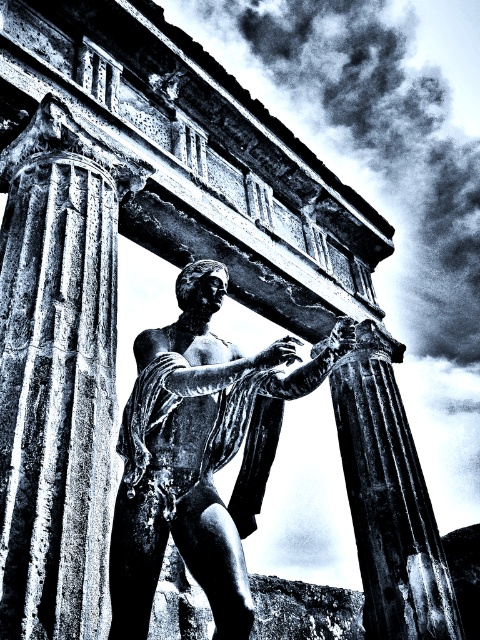
Question: Which of the following is the closest to the observer?

Choices:
 (A) polished bronze statue at center
 (B) smooth stone column at left
 (C) smooth stone column at center

Answer: (B)

Question: Is polished bronze statue at center further to the viewer compared to smooth stone column at center?

Choices:
 (A) yes
 (B) no

Answer: (B)

Question: Which of the following is the farthest from the observer?

Choices:
 (A) smooth stone column at left
 (B) polished bronze statue at center
 (C) smooth stone column at center

Answer: (C)

Question: Is smooth stone column at left above smooth stone column at center?

Choices:
 (A) no
 (B) yes

Answer: (B)

Question: Is polished bronze statue at center wider than smooth stone column at center?

Choices:
 (A) yes
 (B) no

Answer: (A)

Question: Among these objects, which one is farthest from the camera?

Choices:
 (A) polished bronze statue at center
 (B) smooth stone column at center

Answer: (B)